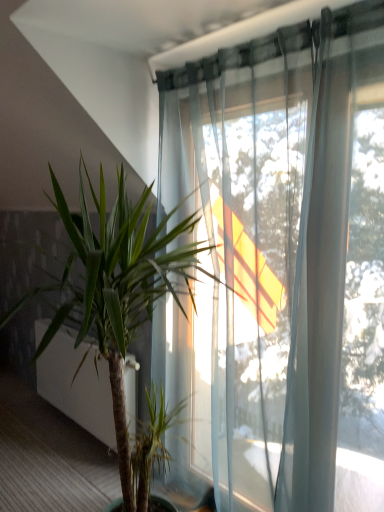
Question: From the image's perspective, is green leafy plant at center on green leafy plant at lower left?

Choices:
 (A) yes
 (B) no

Answer: (A)

Question: From the image's perspective, is green leafy plant at center below green leafy plant at lower left?

Choices:
 (A) no
 (B) yes

Answer: (A)

Question: Is green leafy plant at center shorter than green leafy plant at lower left?

Choices:
 (A) no
 (B) yes

Answer: (A)

Question: Considering the relative positions of green leafy plant at center and green leafy plant at lower left in the image provided, is green leafy plant at center to the left of green leafy plant at lower left from the viewer's perspective?

Choices:
 (A) no
 (B) yes

Answer: (A)

Question: Is green leafy plant at center oriented towards green leafy plant at lower left?

Choices:
 (A) yes
 (B) no

Answer: (B)

Question: Is green leafy plant at center turned away from green leafy plant at lower left?

Choices:
 (A) no
 (B) yes

Answer: (A)

Question: From a real-world perspective, is green leafy plant at lower left located beneath green leafy plant at center?

Choices:
 (A) no
 (B) yes

Answer: (B)

Question: From a real-world perspective, is green leafy plant at lower left on green leafy plant at center?

Choices:
 (A) yes
 (B) no

Answer: (B)

Question: Is green leafy plant at lower left placed right next to green leafy plant at center?

Choices:
 (A) yes
 (B) no

Answer: (B)

Question: From the image's perspective, is green leafy plant at lower left located beneath green leafy plant at center?

Choices:
 (A) no
 (B) yes

Answer: (B)

Question: Is green leafy plant at lower left in front of green leafy plant at center?

Choices:
 (A) no
 (B) yes

Answer: (A)

Question: Can you confirm if green leafy plant at lower left is taller than green leafy plant at center?

Choices:
 (A) no
 (B) yes

Answer: (A)

Question: In terms of size, does green leafy plant at center appear bigger or smaller than green leafy plant at lower left?

Choices:
 (A) big
 (B) small

Answer: (A)